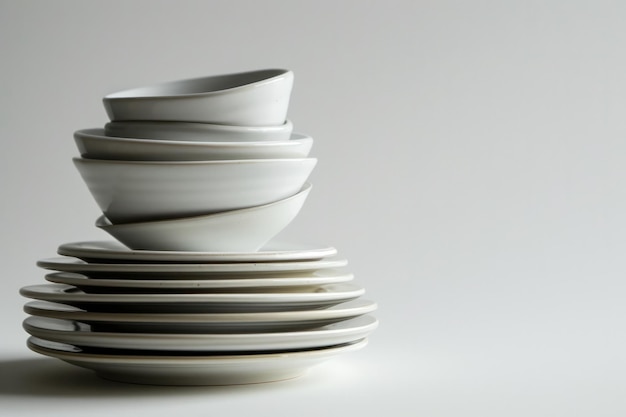
Image resolution: width=626 pixels, height=417 pixels. Find the location of `bowl`. bowl is located at coordinates (264, 94), (207, 133), (255, 149), (227, 181), (255, 230).